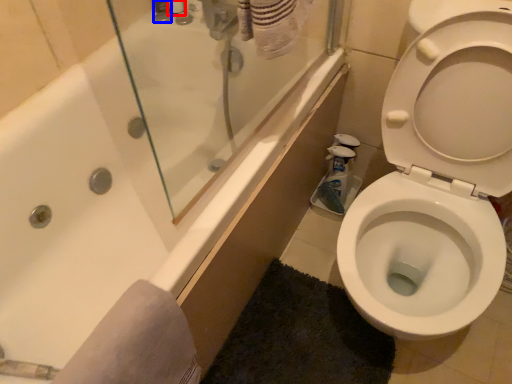
Question: Among these objects, which one is farthest to the camera, toiletry (highlighted by a red box) or toiletry (highlighted by a blue box)?

Choices:
 (A) toiletry
 (B) toiletry

Answer: (A)